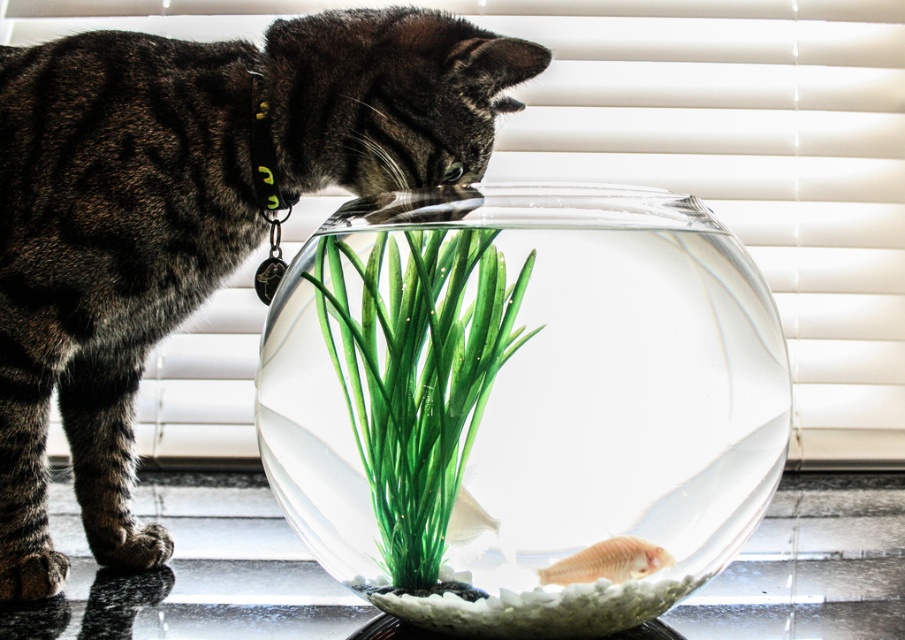
You are a small toy that is 5 cm in width. You want to place yourself between the green plastic plant at center and the translucent plastic fish at center inside the fishbowl. Is there enough space for you to fit there?

The green plastic plant at center might be wider than the translucent plastic fish at center, so there may not be enough space for the toy to fit between them.

You are a cat owner who wants to ensure your cat stays safe. The cat is near a fishbowl with a fish inside. Based on the scene described, which object is closer to you, the dark brown fur cat at left or the translucent plastic fish at center? Why?

The dark brown fur cat at left is closer to you because it is positioned further to the viewer than the translucent plastic fish at center, meaning the cat is nearer in the scene.

Looking at this image, you are a goldfish in the fishbowl. You want to hide from the dark brown fur cat at left. Which direction should you swim to get closer to the green plastic plant at center?

The dark brown fur cat at left is closer to you than the green plastic plant at center. To hide behind the green plastic plant at center, you should swim towards the center of the fishbowl where the plant is located.